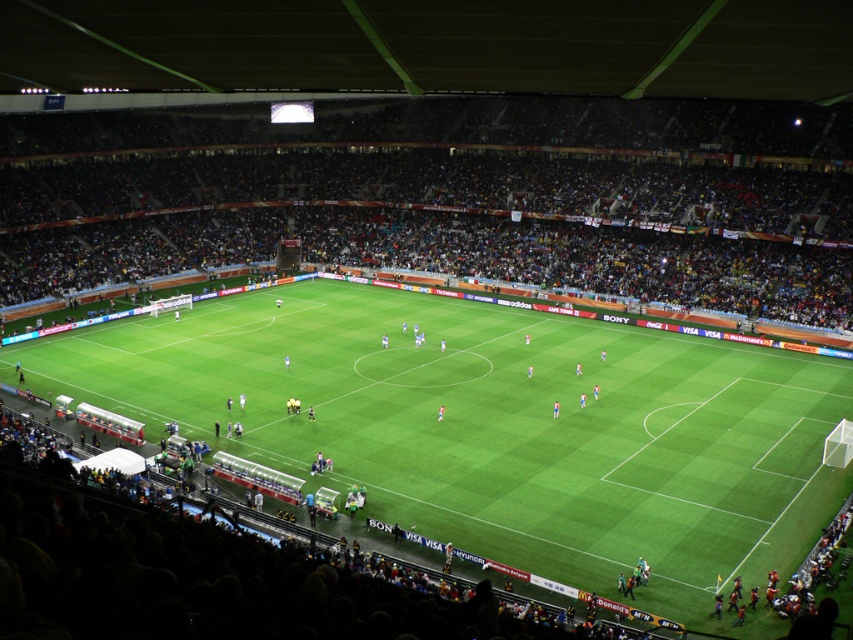
Question: Is green grass football field at center positioned behind dark brown stadium seats at center?

Choices:
 (A) yes
 (B) no

Answer: (B)

Question: Which point appears farthest from the camera in this image?

Choices:
 (A) (804, 314)
 (B) (717, 406)

Answer: (A)

Question: Is green grass football field at center to the left of dark brown stadium seats at center from the viewer's perspective?

Choices:
 (A) no
 (B) yes

Answer: (A)

Question: Which object is closer to the camera taking this photo?

Choices:
 (A) green grass football field at center
 (B) dark brown stadium seats at center

Answer: (A)

Question: Does green grass football field at center appear on the right side of dark brown stadium seats at center?

Choices:
 (A) no
 (B) yes

Answer: (B)

Question: Which point is farther to the camera?

Choices:
 (A) (820, 324)
 (B) (392, 314)

Answer: (B)